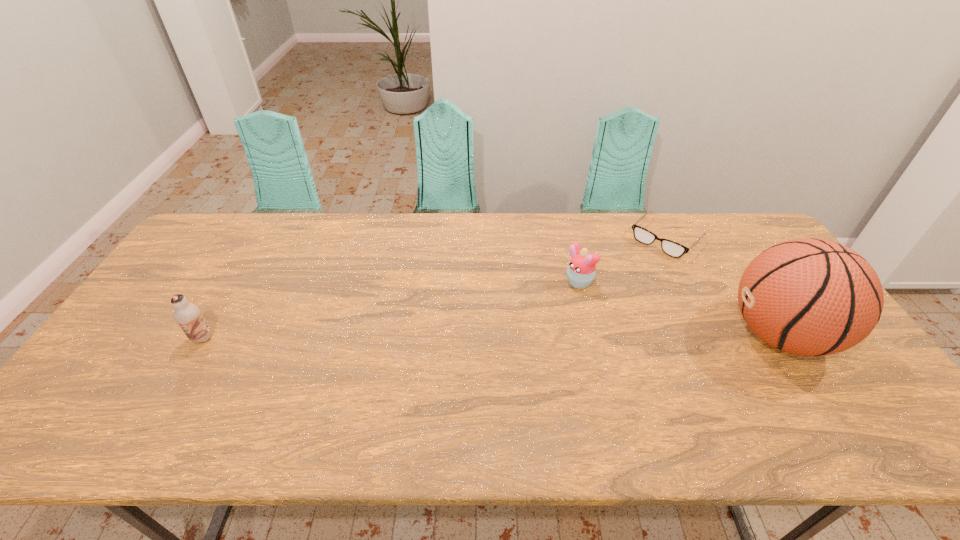
The width and height of the screenshot is (960, 540). Identify the location of vacant area situated on the side where the inflation valve is located. (658, 335).

This screenshot has height=540, width=960. What are the coordinates of `vacant position located on the face of the third object from right to left` in the screenshot? It's located at (552, 301).

This screenshot has width=960, height=540. I want to click on free spot located on the face of the third object from right to left, so click(540, 308).

Where is `vacant position located 0.210m on the face of the third object from right to left`? This screenshot has width=960, height=540. vacant position located 0.210m on the face of the third object from right to left is located at coordinates (513, 325).

Find the location of a particular element. blank space located 0.270m on the front-facing side of the farthest object is located at coordinates (605, 300).

Identify the location of free region located 0.320m on the front-facing side of the farthest object. The width and height of the screenshot is (960, 540). (596, 309).

This screenshot has width=960, height=540. I want to click on free space located on the front-facing side of the farthest object, so click(x=631, y=274).

Where is `object present at the far edge`? object present at the far edge is located at coordinates (671, 248).

Locate an element on the screen. object positioned at the near edge is located at coordinates (810, 297).

This screenshot has height=540, width=960. What are the coordinates of `object situated at the right edge` in the screenshot? It's located at (810, 297).